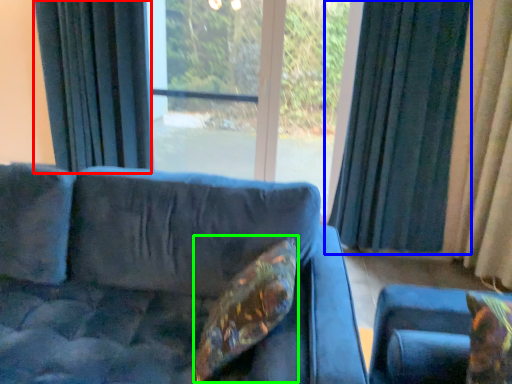
Question: Which object is the closest to the curtain (highlighted by a red box)? Choose among these: curtain (highlighted by a blue box) or pillow (highlighted by a green box).

Choices:
 (A) curtain
 (B) pillow

Answer: (A)